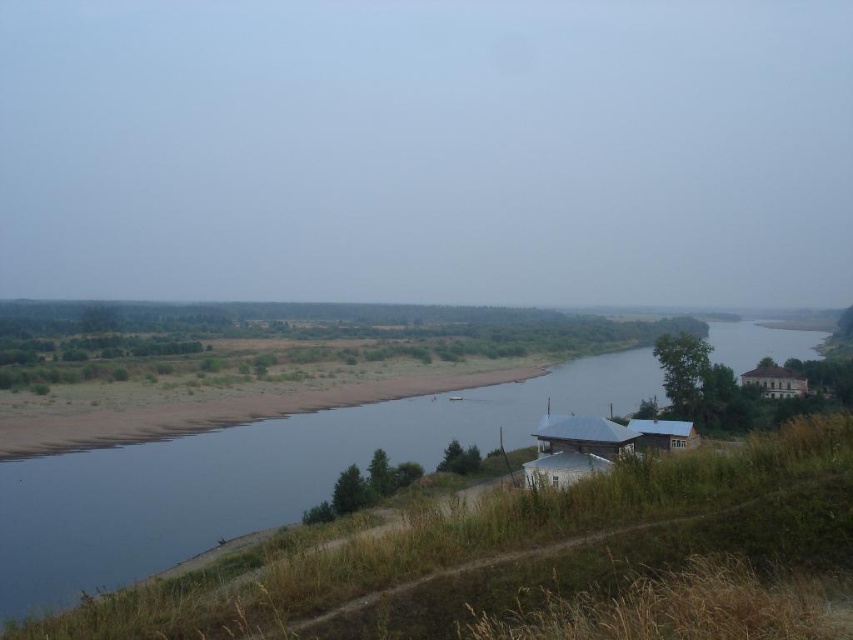
Consider the image. You are standing at the origin point of the image coordinate system, which is the bottom left corner. You want to move towards the white wooden hut at lower center. In which direction should you move relative to your current position?

Since the white wooden hut at lower center is located at point (x=585, y=435) in the 2D coordinate system, you should move towards the upper right direction from your current position at the origin to reach it.

You are standing at the point marked as point (252, 508) in the image, which is 132.20 feet away from you. You want to cross the river to reach the cluster of small wooden houses on the right bank. The river is 100 feet wide. Can you safely cross the river without getting wet?

The point marked as point (252, 508) is 132.20 feet away from you. Since the river is 100 feet wide, you can safely cross the river without getting wet by moving towards the cluster of small wooden houses on the right bank as the distance to the point is greater than the river width.